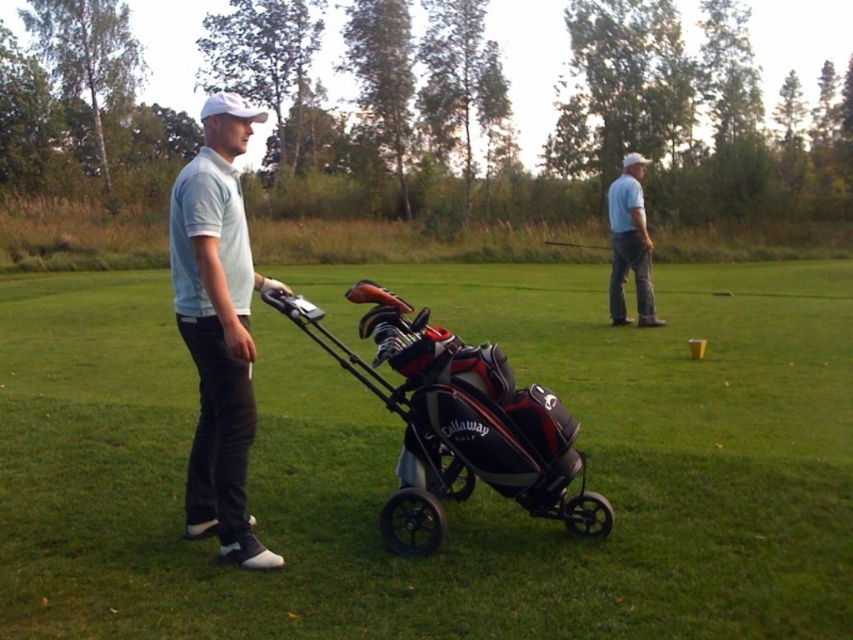
You are a golfer who wants to place both the black fabric golf bag at center and the metallic silver golf club at center into your trunk. The trunk has a height limit of 1 meter. Which item might exceed the height limit?

The metallic silver golf club at center might exceed the height limit because the black fabric golf bag at center is not as tall as the metallic silver golf club at center, so the golf club is taller.

You are a golfer who just arrived at the tee box and see the blue cotton shirt at upper right and the metallic silver golf club at center. Which object is higher in the image?

The blue cotton shirt at upper right is higher in the image than the metallic silver golf club at center.

You are a golfer who wants to place a small marker at the point marked by the coordinates point [448,504]. Where exactly on the black fabric golf bag at center should you place the marker?

The point [448,504] is located on the black fabric golf bag at center, so you should place the marker there.